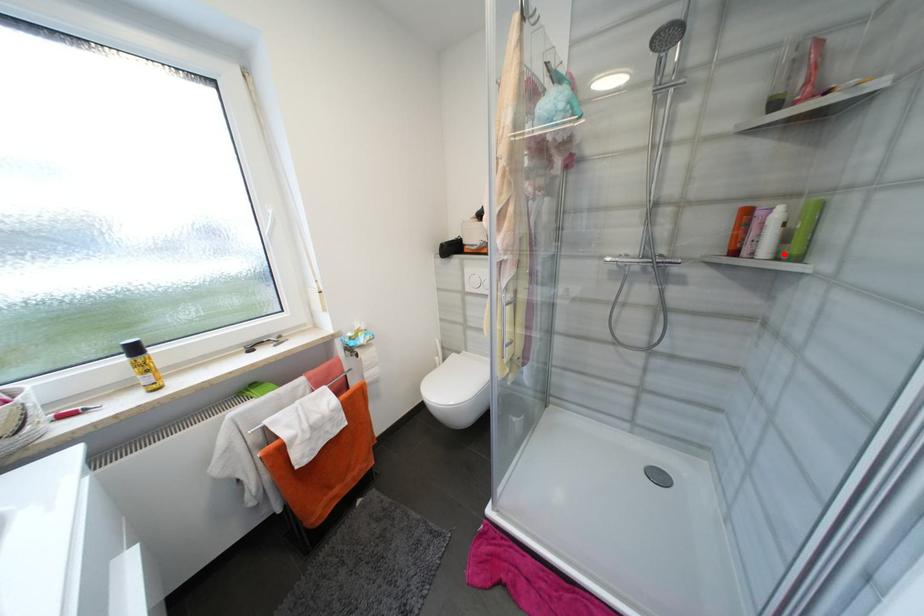
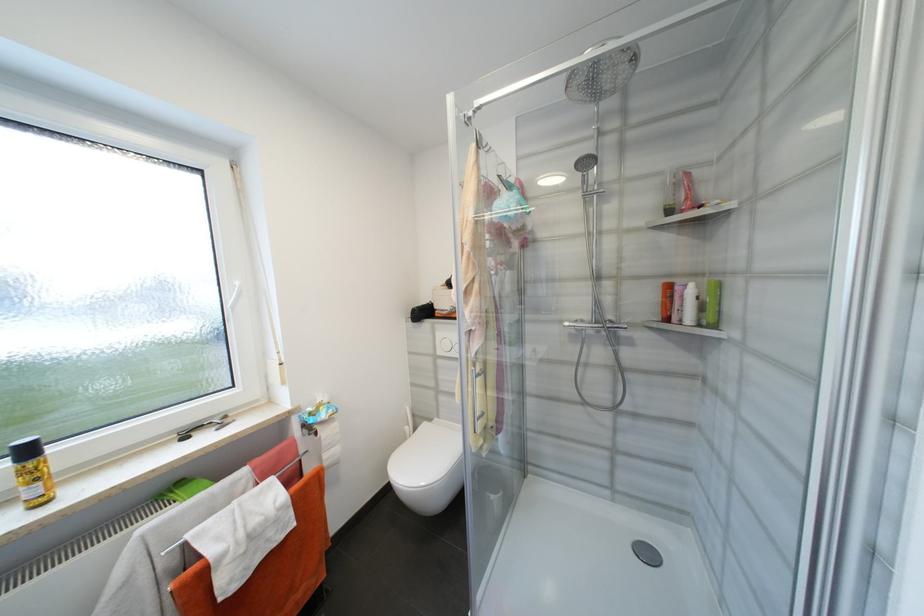
Where in the second image is the point corresponding to the highlighted location from the first image?

(704, 322)